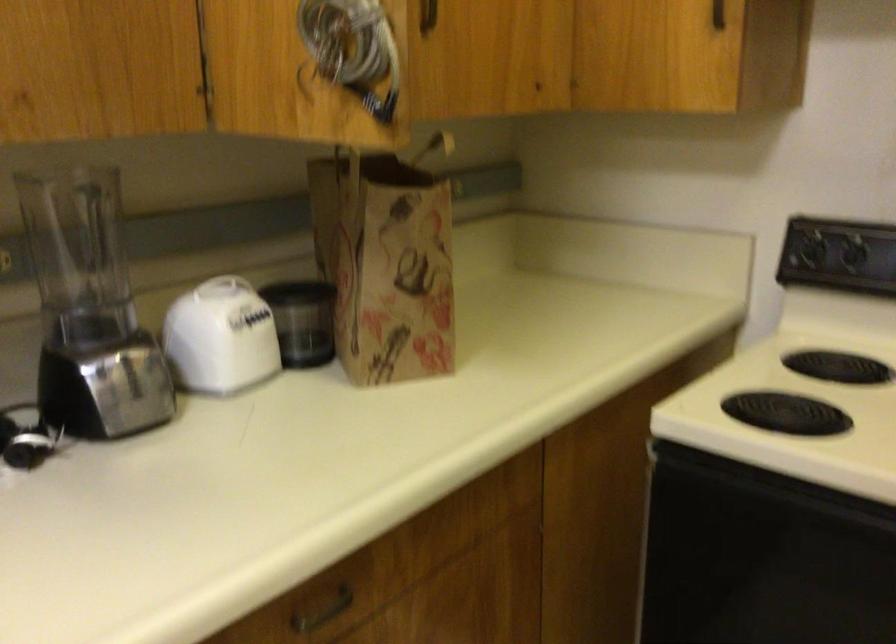
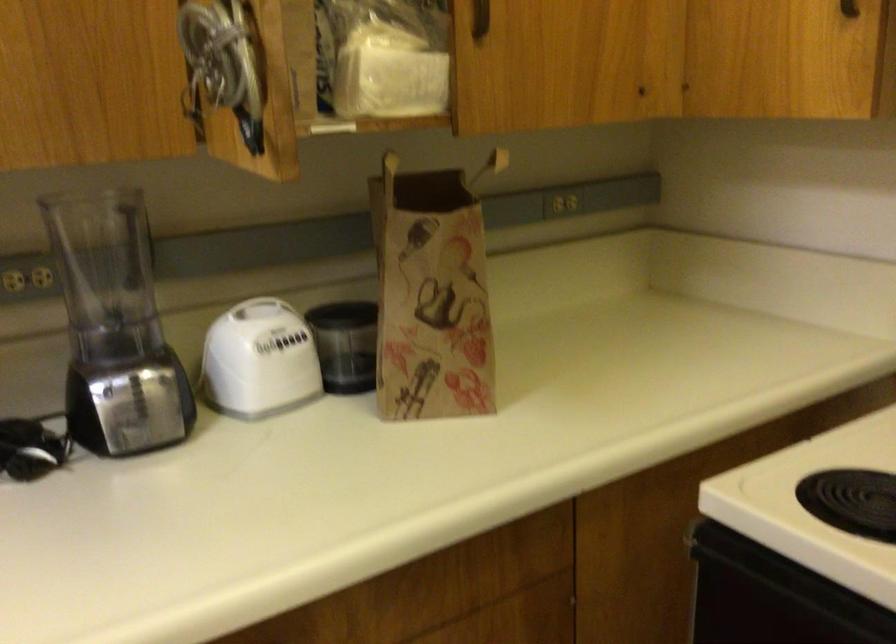
The point at (x=213, y=292) is marked in the first image. Where is the corresponding point in the second image?

(260, 308)